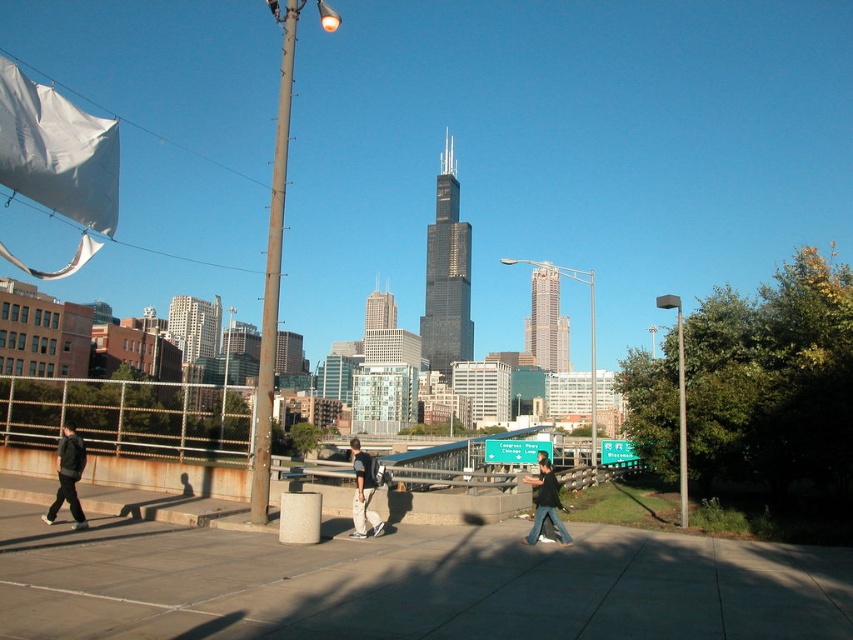
Question: Does black glass skyscraper at center appear under gray glass skyscraper at center?

Choices:
 (A) no
 (B) yes

Answer: (A)

Question: Does dark gray pants at left appear under smooth glass skyscraper at center?

Choices:
 (A) yes
 (B) no

Answer: (A)

Question: Does gray concrete sidewalk at center have a smaller size compared to dark gray jeans at center?

Choices:
 (A) yes
 (B) no

Answer: (B)

Question: Which object is closer to the camera taking this photo?

Choices:
 (A) white glass building at left
 (B) gray glass skyscraper at center
 (C) dark gray pants at left
 (D) smooth glass skyscraper at center

Answer: (C)

Question: Considering the real-world distances, which object is closest to the gray concrete sidewalk at center?

Choices:
 (A) black glass skyscraper at center
 (B) dark gray hoodie at center
 (C) gray glass skyscraper at center

Answer: (B)

Question: Which object appears closest to the camera in this image?

Choices:
 (A) gray glass skyscraper at center
 (B) gray concrete sidewalk at center
 (C) dark gray hoodie at center
 (D) dark gray jeans at center

Answer: (B)